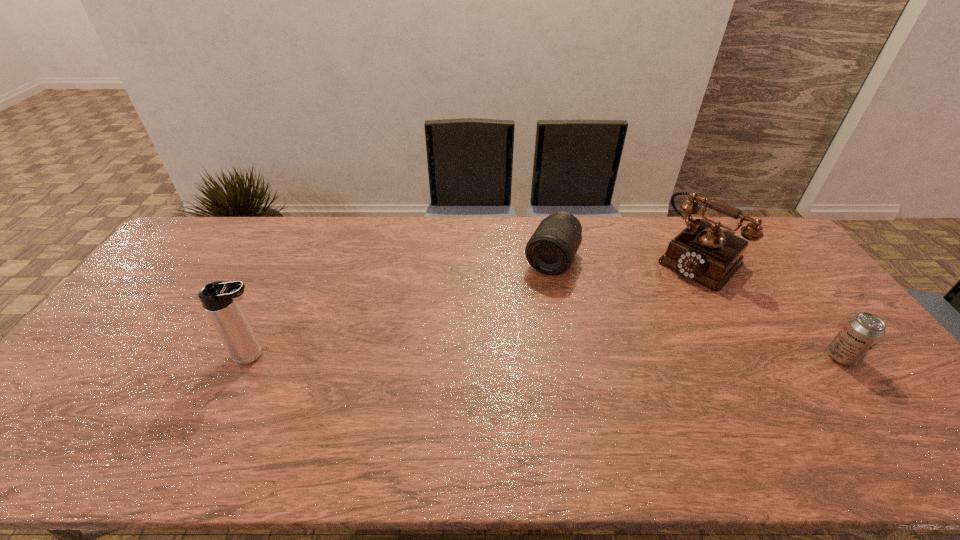
The image size is (960, 540). What are the coordinates of `vacant space situated 0.120m on the surface of the second object from left to right` in the screenshot? It's located at (530, 305).

Find the location of a particular element. free space located on the surface of the second object from left to right is located at coordinates (503, 356).

This screenshot has width=960, height=540. Identify the location of telephone that is at the far edge. (710, 256).

Locate an element on the screen. This screenshot has width=960, height=540. telephoto lens present at the far edge is located at coordinates point(551,250).

This screenshot has width=960, height=540. In order to click on object that is positioned at the right edge in this screenshot , I will do `click(862, 332)`.

I want to click on vacant space at the far edge, so click(306, 218).

Find the location of a particular element. This screenshot has height=540, width=960. free spot at the left edge of the desktop is located at coordinates (156, 278).

Find the location of `free space at the right edge of the desktop`. free space at the right edge of the desktop is located at coordinates (802, 338).

Where is `vacant space at the far left corner of the desktop`? This screenshot has height=540, width=960. vacant space at the far left corner of the desktop is located at coordinates (178, 258).

Find the location of a particular element. vacant space at the far right corner of the desktop is located at coordinates (759, 252).